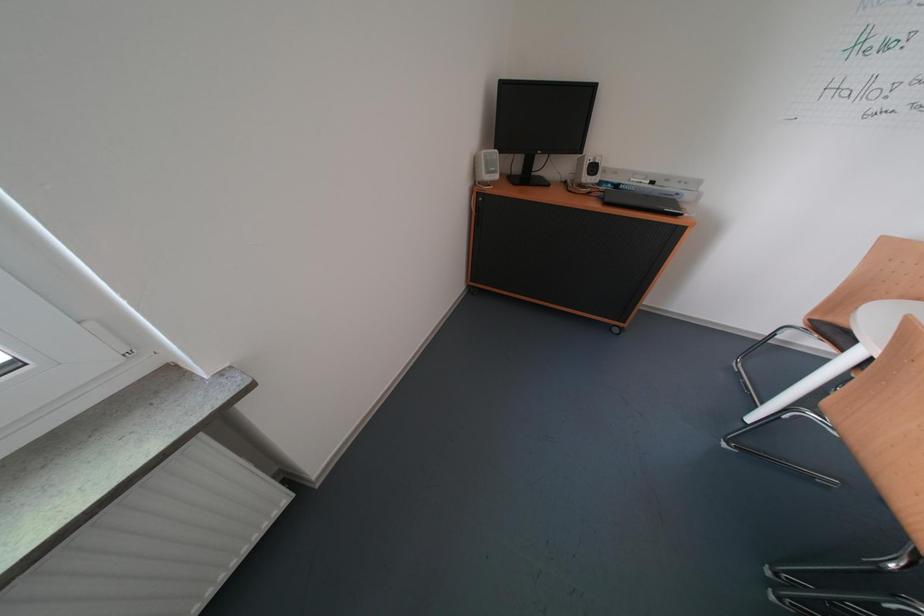
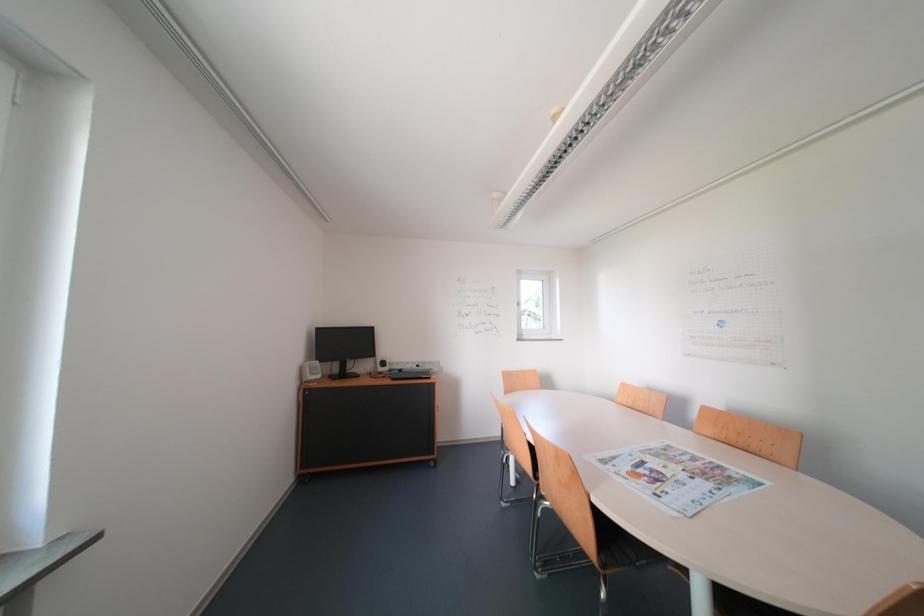
The images are taken continuously from a first-person perspective. In which direction is your viewpoint rotating?

The rotation direction of the camera is right-up.